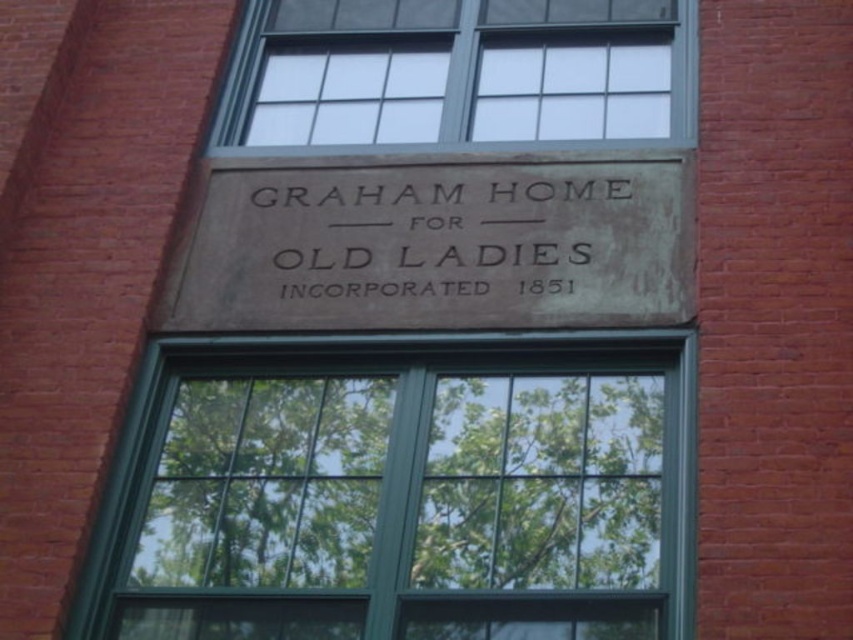
Is green glass window at center bigger than dark gray stone sign at center?

Correct, green glass window at center is larger in size than dark gray stone sign at center.

Based on the photo, how much distance is there between green glass window at center and dark gray stone sign at center?

3.93 meters

Is point (136, 388) positioned before point (496, 275)?

That is True.

The height and width of the screenshot is (640, 853). Find the location of `green glass window at center`. green glass window at center is located at coordinates (401, 490).

Looking at this image, which is above, green glass window at center or clear glass window at upper center?

A: clear glass window at upper center is above.

Which is more to the right, green glass window at center or clear glass window at upper center?

Positioned to the right is clear glass window at upper center.

Where is `green glass window at center`? green glass window at center is located at coordinates (401, 490).

Between clear glass window at upper center and dark gray stone sign at center, which one is positioned higher?

Positioned higher is clear glass window at upper center.

Can you confirm if clear glass window at upper center is positioned above dark gray stone sign at center?

Indeed, clear glass window at upper center is positioned over dark gray stone sign at center.

Which is behind, point (572, 116) or point (561, 262)?

The point (572, 116) is more distant.

What are the coordinates of `clear glass window at upper center` in the screenshot? It's located at (459, 72).